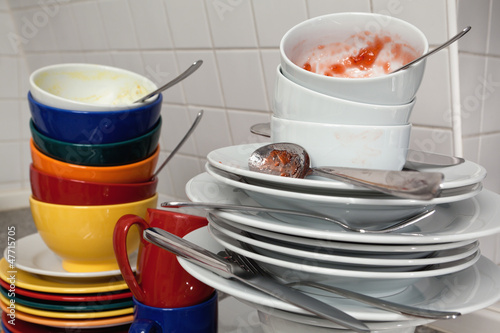
The width and height of the screenshot is (500, 333). In order to click on white plates in this screenshot , I will do `click(219, 283)`, `click(259, 257)`, `click(260, 242)`, `click(263, 231)`, `click(264, 222)`, `click(294, 189)`, `click(297, 180)`, `click(39, 262)`.